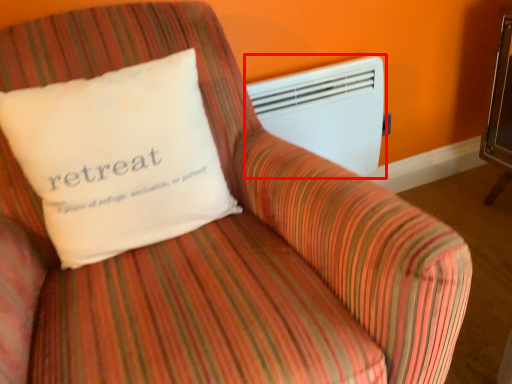
Question: From the image, what is the correct spatial relationship of air conditioning (annotated by the red box) in relation to pillow?

Choices:
 (A) right
 (B) left

Answer: (A)